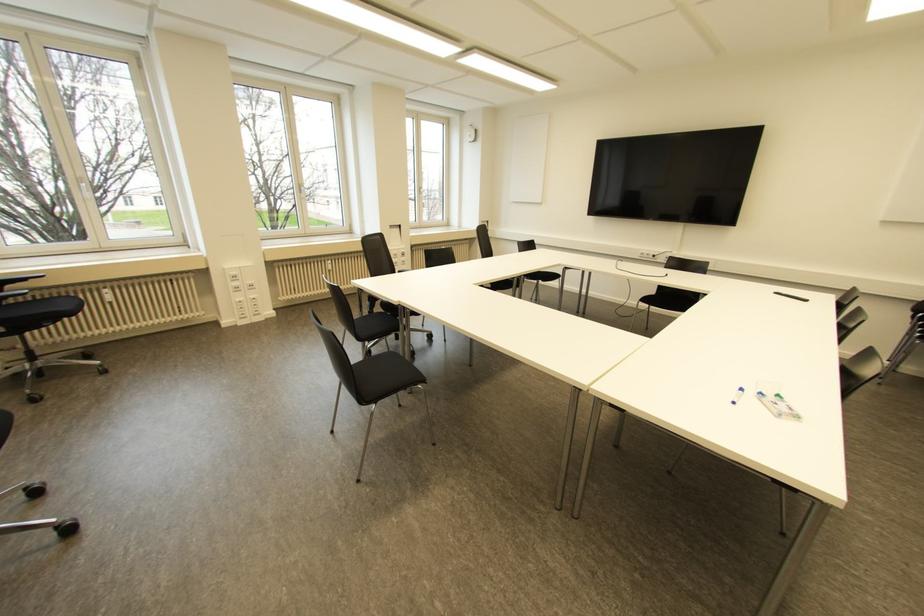
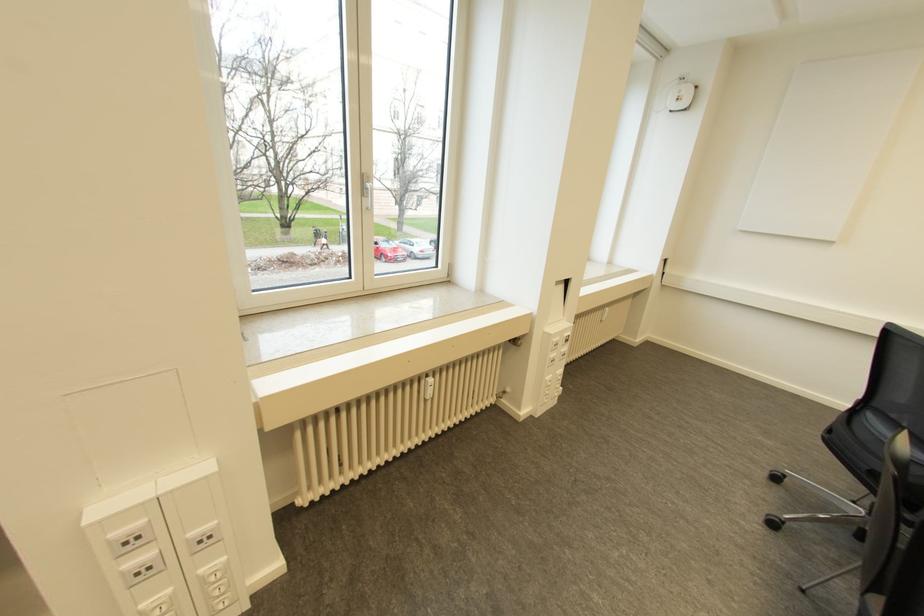
In the second image, find the point that corresponds to pixel 249 282 in the first image.

(197, 531)